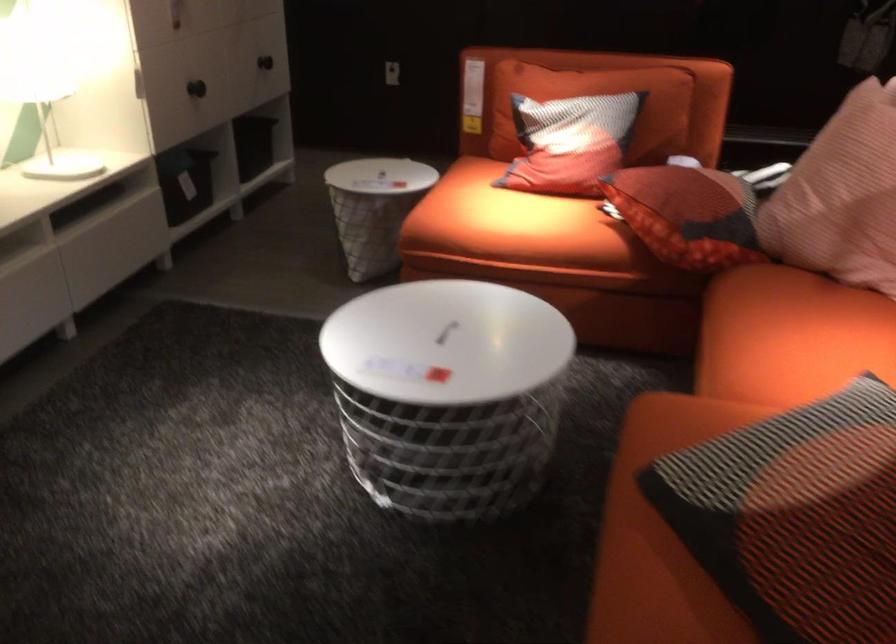
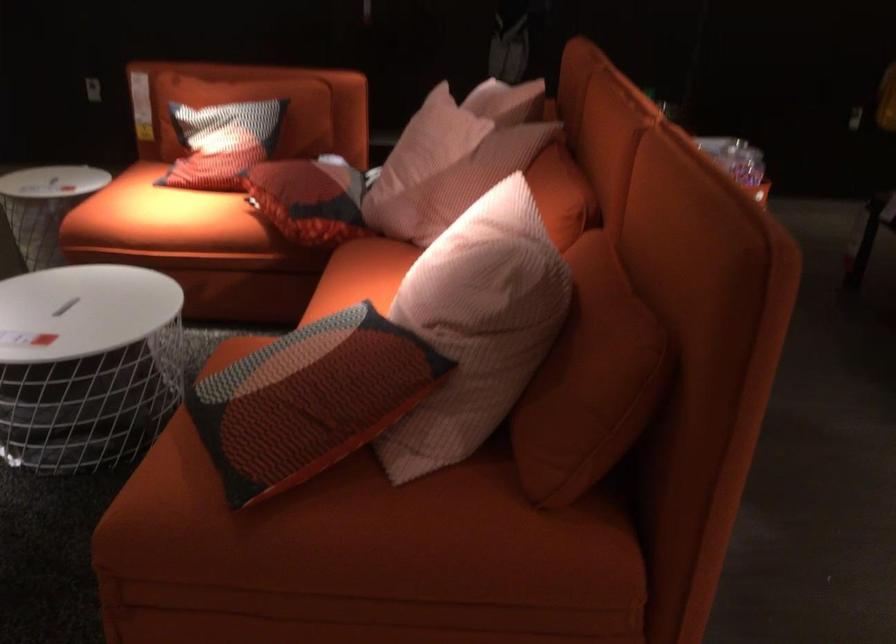
Find the pixel in the second image that matches (511,222) in the first image.

(160, 216)